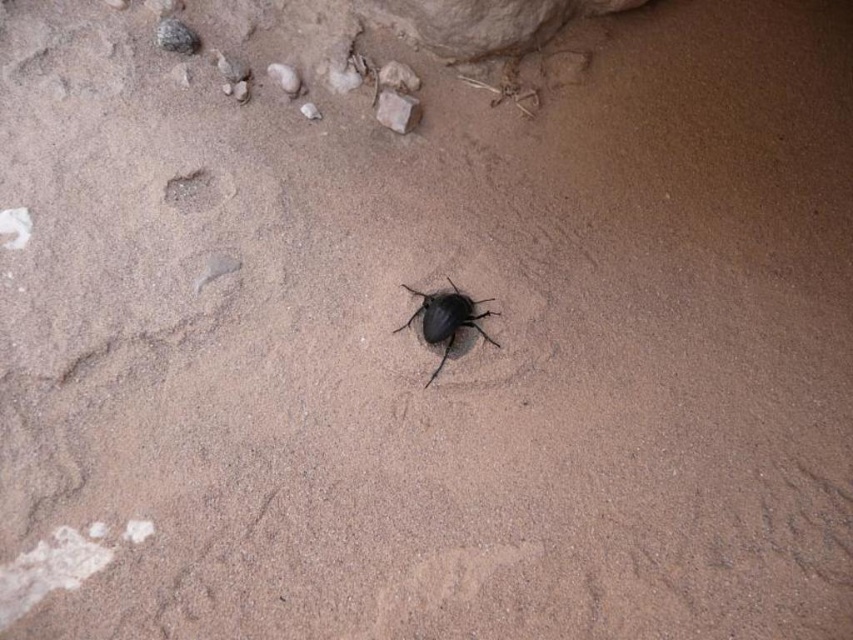
Question: Is black matte beetle at center thinner than smooth brown rock at upper center?

Choices:
 (A) no
 (B) yes

Answer: (A)

Question: In this image, where is black matte beetle at center located relative to smooth brown rock at upper center?

Choices:
 (A) above
 (B) below

Answer: (B)

Question: Which point is farther to the camera?

Choices:
 (A) black matte beetle at center
 (B) smooth brown rock at upper center

Answer: (B)

Question: Which point is farther to the camera?

Choices:
 (A) black matte beetle at center
 (B) smooth brown rock at upper center

Answer: (B)

Question: Does black matte beetle at center have a greater width compared to smooth brown rock at upper center?

Choices:
 (A) no
 (B) yes

Answer: (B)